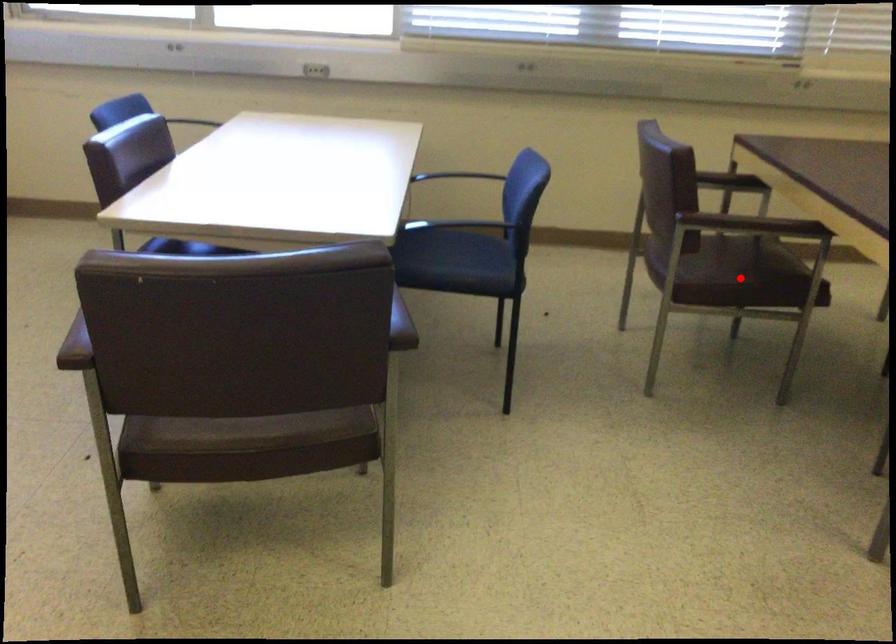
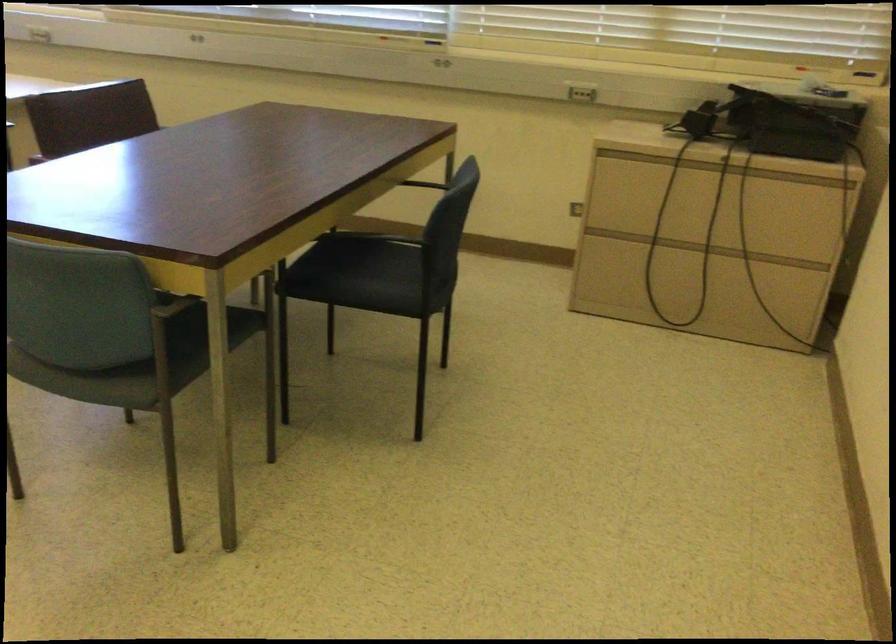
Question: I am providing you with two images of the same scene from different viewpoints. A red point is marked on the first image. At the location where the point appears in image 1, is it still visible in image 2?

Choices:
 (A) Yes
 (B) No

Answer: (B)